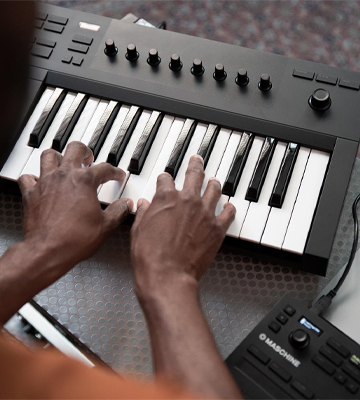
Find the location of `black musical keyboard keys`. black musical keyboard keys is located at coordinates (43, 117), (65, 122), (98, 129), (120, 134), (142, 140), (177, 149), (202, 151), (235, 166), (258, 173), (282, 180).